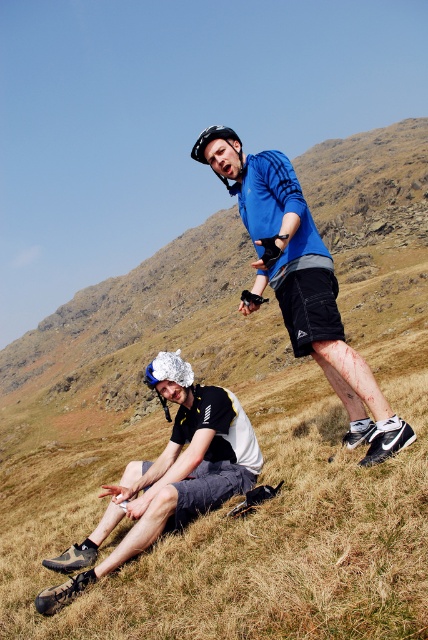
The width and height of the screenshot is (428, 640). I want to click on blue synthetic jacket at upper center, so click(306, 291).

Who is more forward, (284, 243) or (211, 140)?

Point (284, 243) is more forward.

In order to click on blue synthetic jacket at upper center in this screenshot , I will do `click(306, 291)`.

Is brown dry grass at lower center wider than blue synthetic jacket at upper center?

Indeed, brown dry grass at lower center has a greater width compared to blue synthetic jacket at upper center.

Who is more forward, [267,502] or [386,404]?

Point [386,404] is more forward.

Find the location of a particular element. The width and height of the screenshot is (428, 640). brown dry grass at lower center is located at coordinates (237, 525).

At what (x,y) coordinates should I click in order to perform the action: click on brown dry grass at lower center. Please return your answer as a coordinate pair (x, y). Looking at the image, I should click on (237, 525).

Can you confirm if brown dry grass at lower center is positioned below black mesh shorts at lower left?

Yes.

Find the location of a particular element. The width and height of the screenshot is (428, 640). brown dry grass at lower center is located at coordinates (237, 525).